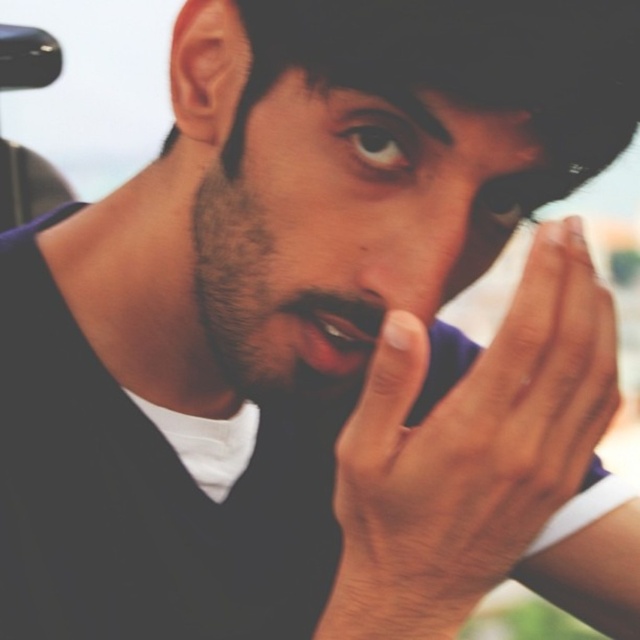
In the scene shown: You are a photographer adjusting the focus on your camera. You want to ensure that both the smooth skin face at center and the smooth skin nose at center are in focus. Based on the scene description, which object should you focus on first to achieve this?

The smooth skin face at center is closer to the viewer than the smooth skin nose at center. To ensure both are in focus, you should focus on the smooth skin face at center first, as it is closer, and adjust the depth of field accordingly.

Based on the scene description, which object has a greater width between the smooth skin face at center and the smooth glossy lips at center?

The smooth skin face at center has a greater width than the smooth glossy lips at center.

You are a photographer adjusting the camera focus. The subject has a smooth skin face at center. Where should you adjust the focus point to ensure the face is in sharp focus?

The smooth skin face at center is located at the 2D coordinates point (342, 224), so you should adjust the focus point to that location to ensure the face is in sharp focus.